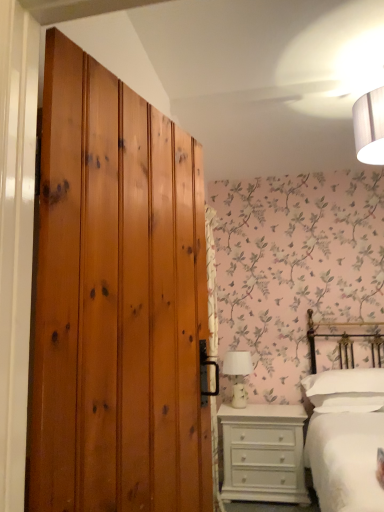
Question: Considering the positions of white soft pillow at right and white ceramic table lamp at center in the image, is white soft pillow at right taller or shorter than white ceramic table lamp at center?

Choices:
 (A) short
 (B) tall

Answer: (A)

Question: Is point (367, 382) positioned closer to the camera than point (235, 388)?

Choices:
 (A) closer
 (B) farther

Answer: (A)

Question: Estimate the real-world distances between objects in this image. Which object is closer to the white painted wood chest of drawers at lower right?

Choices:
 (A) white soft pillow at right
 (B) white ceramic table lamp at center
 (C) white cotton bed at right
 (D) wooden wardrobe at left

Answer: (C)

Question: Which is farther from the white painted wood chest of drawers at lower right?

Choices:
 (A) white soft pillow at right
 (B) wooden wardrobe at left
 (C) white cotton bed at right
 (D) white ceramic table lamp at center

Answer: (B)